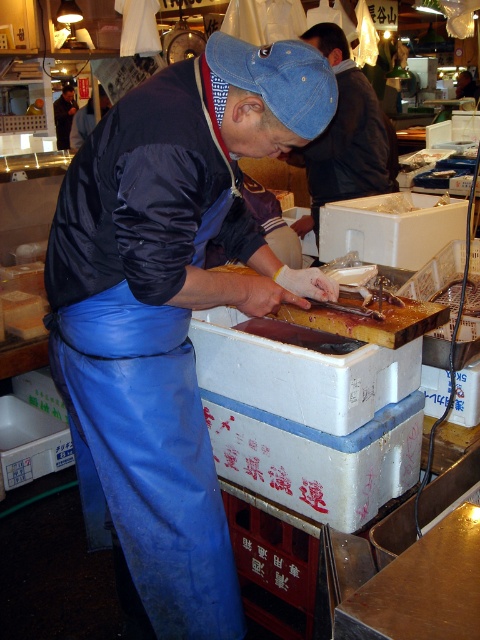
You are a customer at the fish market and want to identify the vendor. Which object, the blue denim cap at upper center or the dark blue apron at lower left, is bigger and thus more noticeable from a distance?

The blue denim cap at upper center is larger in size than the dark blue apron at lower left, so it is more noticeable from a distance.

You are a customer at the fish market and want to ask the worker wearing the dark blue apron at lower left a question. Which direction should you move to face the worker while standing near the blue denim cap at upper center?

The blue denim cap at upper center is to the right of the dark blue apron at lower left. To face the worker wearing the dark blue apron at lower left from the blue denim cap at upper center, you should move to your left.